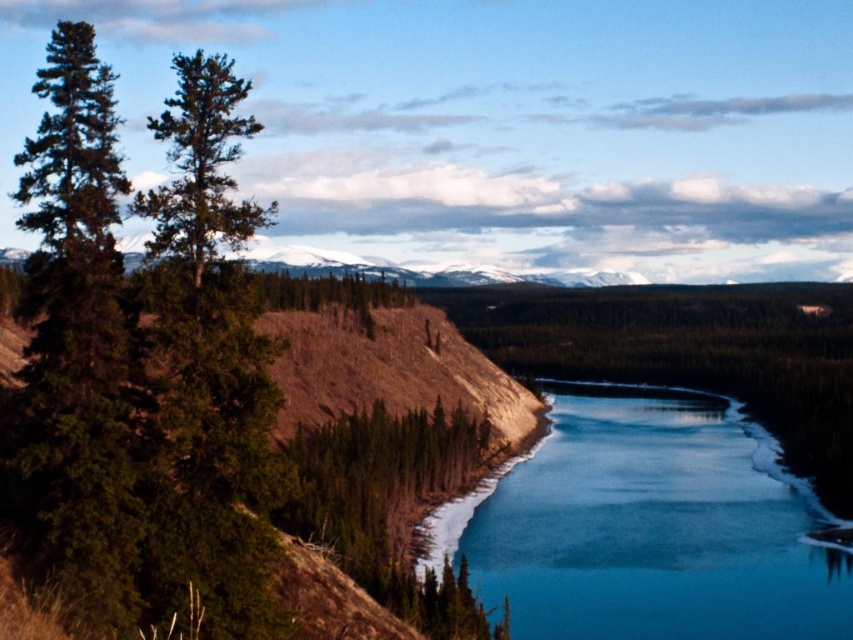
You are a hiker looking at the landscape and want to reach the snow capped mountains in the background. Which object would you need to pass first, the blue ice at center or the green matte tree at upper left?

You would need to pass the blue ice at center first because it is closer to you than the green matte tree at upper left.

You are an explorer in the wilderness and need to cross the river. You see the blue ice at center and the green matte tree at upper left. Which object is smaller in size?

The blue ice at center has a smaller size compared to the green matte tree at upper left, so the blue ice at center is smaller.